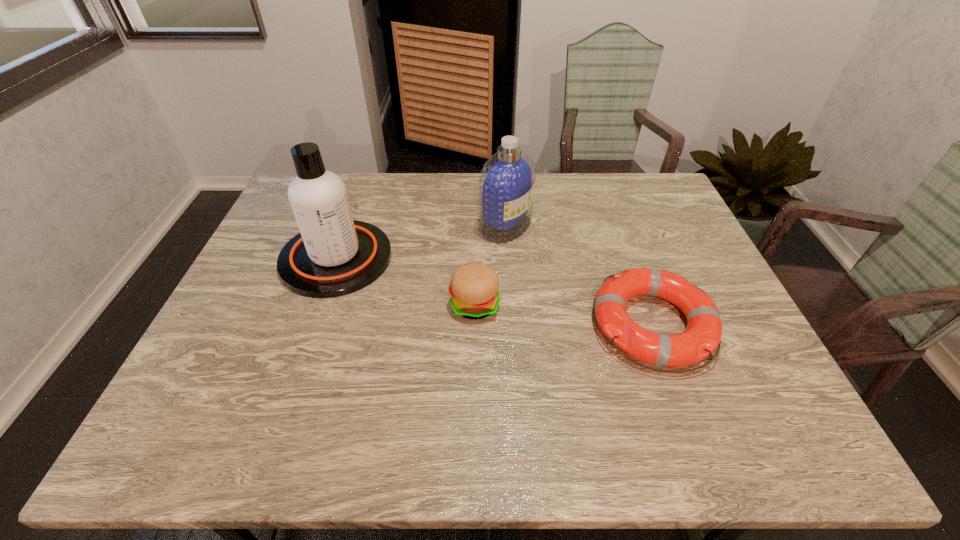
Identify the location of the left cleansing agent. This screenshot has width=960, height=540. (333, 255).

Where is `the tallest object`? the tallest object is located at coordinates (333, 255).

The width and height of the screenshot is (960, 540). I want to click on the shorter cleansing agent, so click(507, 179).

This screenshot has width=960, height=540. I want to click on the right cleansing agent, so click(x=507, y=179).

Locate an element on the screen. the second shortest object is located at coordinates (474, 286).

Where is `the shortest object`? the shortest object is located at coordinates (700, 339).

Locate an element on the screen. This screenshot has width=960, height=540. life buoy is located at coordinates coord(700,339).

Find the location of a particular element. This screenshot has height=540, width=960. vacant space situated 0.220m on the back of the left cleansing agent is located at coordinates (362, 186).

You are a GUI agent. You are given a task and a screenshot of the screen. Output one action in this format:
    pyautogui.click(x=<x>, y=<y>)
    Task: Click on the free space located 0.300m on the front of the shorter cleansing agent
    The height and width of the screenshot is (540, 960).
    Given the screenshot: What is the action you would take?
    pyautogui.click(x=513, y=322)

The height and width of the screenshot is (540, 960). Find the location of `vacant region located on the front of the second shortest object`. vacant region located on the front of the second shortest object is located at coordinates (473, 455).